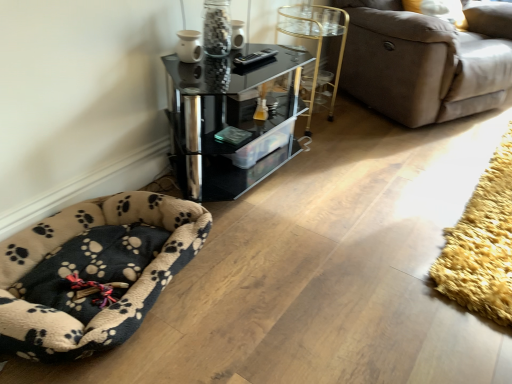
Question: Considering the relative sizes of brown fabric couch at upper right and transparent glass jar at upper center in the image provided, is brown fabric couch at upper right shorter than transparent glass jar at upper center?

Choices:
 (A) no
 (B) yes

Answer: (A)

Question: From the image's perspective, is brown fabric couch at upper right below transparent glass jar at upper center?

Choices:
 (A) no
 (B) yes

Answer: (A)

Question: Would you consider brown fabric couch at upper right to be distant from transparent glass jar at upper center?

Choices:
 (A) no
 (B) yes

Answer: (B)

Question: From a real-world perspective, does brown fabric couch at upper right sit lower than transparent glass jar at upper center?

Choices:
 (A) no
 (B) yes

Answer: (B)

Question: Is brown fabric couch at upper right further to camera compared to transparent glass jar at upper center?

Choices:
 (A) no
 (B) yes

Answer: (B)

Question: Does brown fabric couch at upper right come in front of transparent glass jar at upper center?

Choices:
 (A) no
 (B) yes

Answer: (A)

Question: Can you confirm if yellow shaggy rug at lower right is smaller than transparent glass jar at upper center?

Choices:
 (A) no
 (B) yes

Answer: (A)

Question: Considering the relative sizes of yellow shaggy rug at lower right and transparent glass jar at upper center in the image provided, is yellow shaggy rug at lower right bigger than transparent glass jar at upper center?

Choices:
 (A) no
 (B) yes

Answer: (B)

Question: Is yellow shaggy rug at lower right not inside transparent glass jar at upper center?

Choices:
 (A) yes
 (B) no

Answer: (A)

Question: From a real-world perspective, is yellow shaggy rug at lower right positioned over transparent glass jar at upper center based on gravity?

Choices:
 (A) yes
 (B) no

Answer: (B)

Question: From the image's perspective, is yellow shaggy rug at lower right on top of transparent glass jar at upper center?

Choices:
 (A) yes
 (B) no

Answer: (B)

Question: Is yellow shaggy rug at lower right positioned with its back to transparent glass jar at upper center?

Choices:
 (A) no
 (B) yes

Answer: (A)

Question: Can you confirm if beige fleece dog bed at lower left is positioned to the right of black glass table at upper center?

Choices:
 (A) no
 (B) yes

Answer: (A)